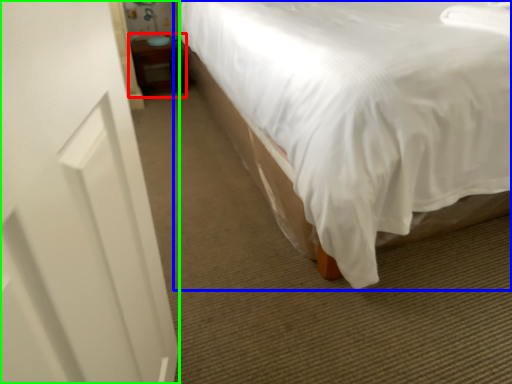
Question: Which object is the closest to the table (highlighted by a red box)? Choose among these: bed (highlighted by a blue box) or screen door (highlighted by a green box).

Choices:
 (A) bed
 (B) screen door

Answer: (A)